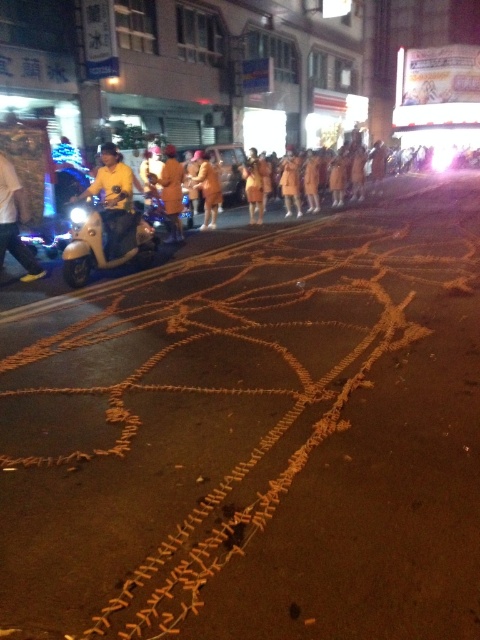
You are standing at the point marked as point [113,196]. What object are you on?

You are on the yellow matte scooter at left.

You are a pedestrian trying to walk from the left side of the street to the right side. There is a matte silver scooter at left and an orange fabric at center. Which object is closer to your starting position?

The matte silver scooter at left is closer to your starting position on the left side since it is positioned to the left of the orange fabric at center.